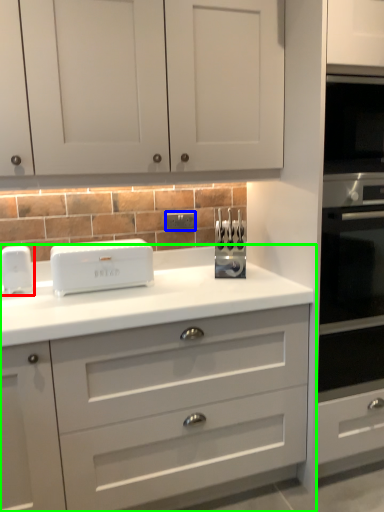
Question: Which is farther away from home appliance (highlighted by a red box)? electric outlet (highlighted by a blue box) or chest of drawers (highlighted by a green box)?

Choices:
 (A) electric outlet
 (B) chest of drawers

Answer: (B)